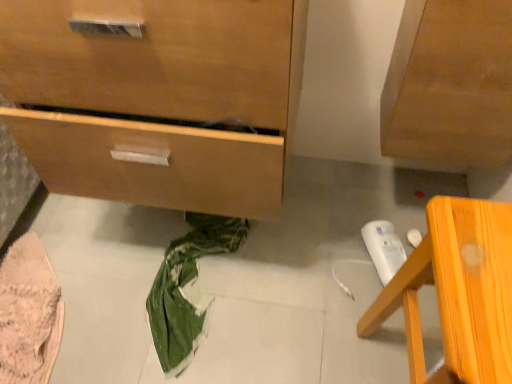
Find the location of `free area below pink knitted fabric at lower left (from a real-world perspective)`. free area below pink knitted fabric at lower left (from a real-world perspective) is located at coordinates (68, 294).